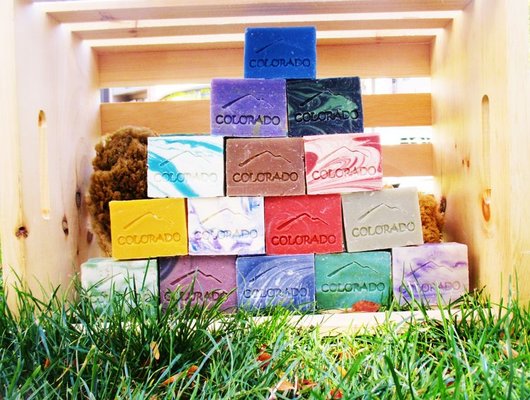
Find the location of `decorative soap`. decorative soap is located at coordinates (155, 230).